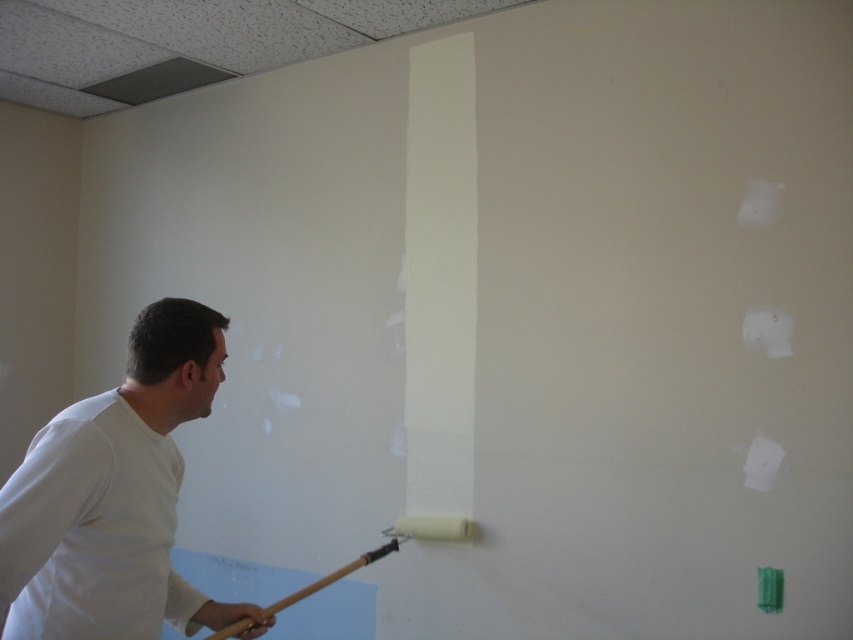
You are a painter working on the wall and need to avoid getting paint on your white matte shirt at left. Based on the position of the shirt and the paint roller, which direction should you move the roller to keep it away from the shirt?

The white matte shirt at left is located at point (115, 497). To avoid getting paint on it, move the roller away from the shirt by directing it towards the opposite direction of the shirt.